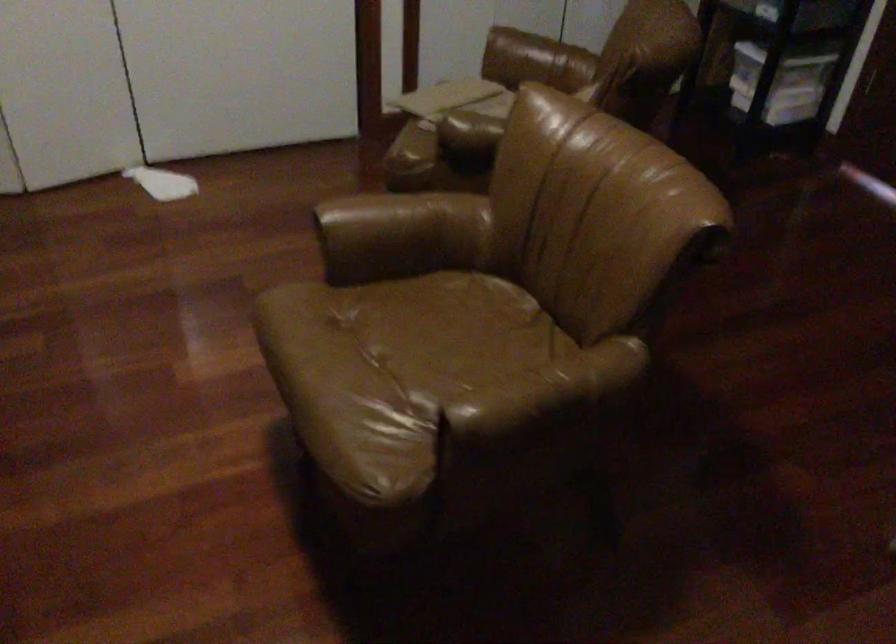
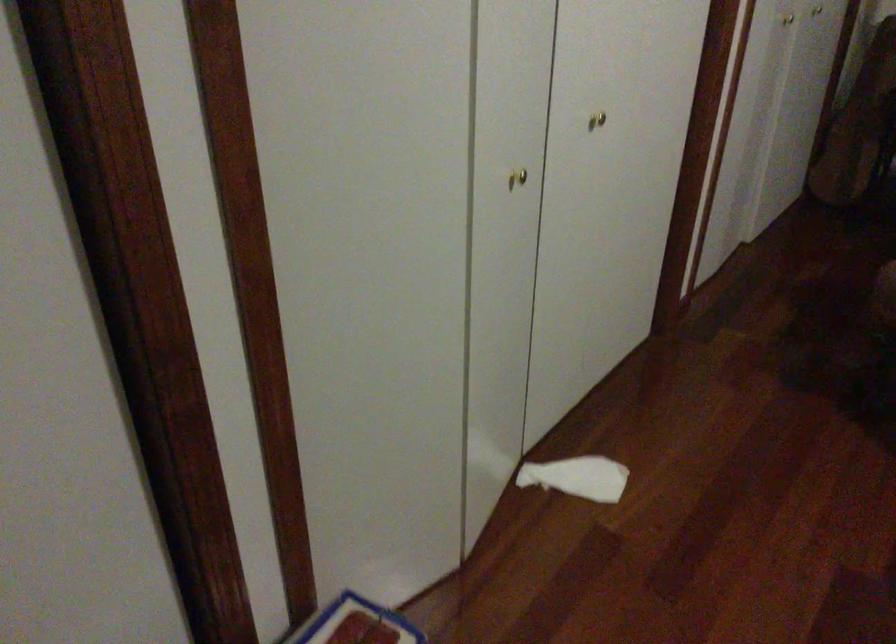
Locate, in the second image, the point that corresponds to point (170, 180) in the first image.

(578, 477)